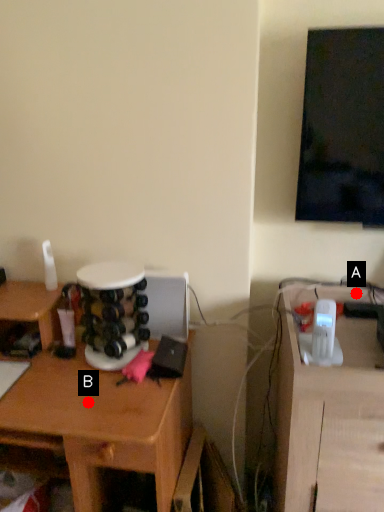
Question: Two points are circled on the image, labeled by A and B beside each circle. Which point is further to the camera?

Choices:
 (A) A is further
 (B) B is further

Answer: (A)